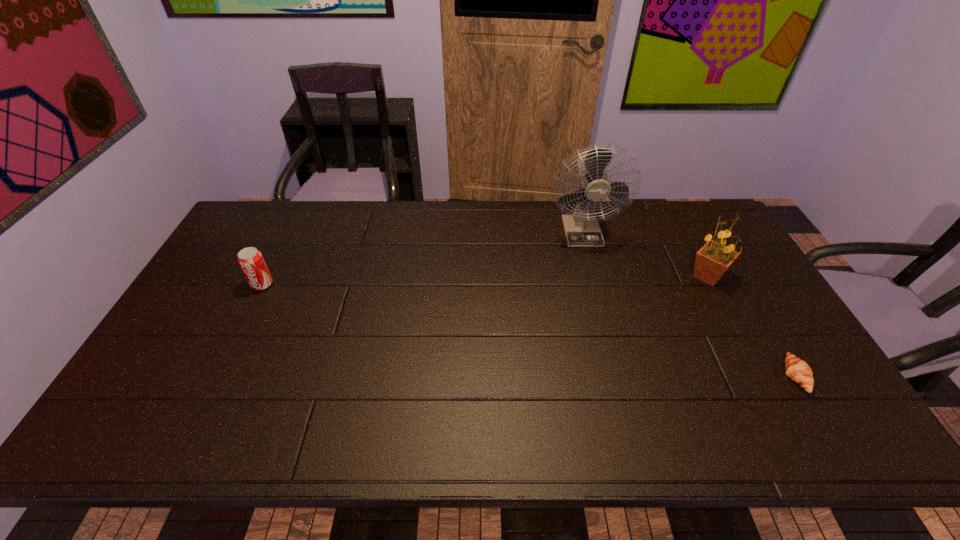
Where is `vacant space in between the soda can and the tallest object`? Image resolution: width=960 pixels, height=540 pixels. vacant space in between the soda can and the tallest object is located at coordinates (421, 258).

Where is `vacant point located between the farthest object and the sunflower`? vacant point located between the farthest object and the sunflower is located at coordinates click(644, 253).

At what (x,y) coordinates should I click in order to perform the action: click on free space between the second tallest object and the pastry. Please return your answer as a coordinate pair (x, y). This screenshot has height=540, width=960. Looking at the image, I should click on coord(751,326).

You are a GUI agent. You are given a task and a screenshot of the screen. Output one action in this format:
    pyautogui.click(x=<x>, y=<y>)
    Task: Click on the vacant point located between the third tallest object and the tallest object
    This screenshot has width=960, height=540.
    Given the screenshot: What is the action you would take?
    pyautogui.click(x=421, y=258)

Locate which object is the closest to the sunflower. Please provide its 2D coordinates. Your answer should be formatted as a tuple, i.e. [(x, y)], where the tuple contains the x and y coordinates of a point satisfying the conditions above.

[(581, 229)]

Identify which object is the closest to the leftmost object. Please provide its 2D coordinates. Your answer should be formatted as a tuple, i.e. [(x, y)], where the tuple contains the x and y coordinates of a point satisfying the conditions above.

[(581, 229)]

Locate an element on the screen. This screenshot has height=540, width=960. free space that satisfies the following two spatial constraints: 1. at the front of the sunflower with flowers visible; 2. on the logo side of the soda can is located at coordinates (712, 285).